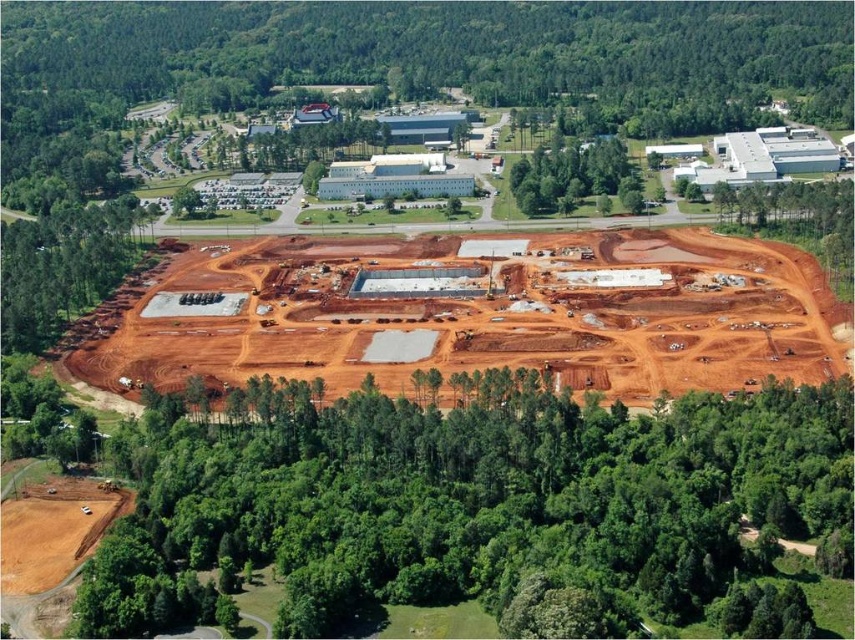
Question: Does green leafy trees at lower center appear on the right side of reddish-brown dirt field at center?

Choices:
 (A) yes
 (B) no

Answer: (B)

Question: Which of these objects is positioned closest to the green leafy tree at upper center?

Choices:
 (A) green leafy trees at lower center
 (B) reddish-brown dirt field at center

Answer: (B)

Question: Which point appears closest to the camera in this image?

Choices:
 (A) (287, 451)
 (B) (540, 160)
 (C) (326, 301)

Answer: (A)

Question: Is reddish-brown dirt field at center closer to the viewer compared to green leafy tree at upper center?

Choices:
 (A) no
 (B) yes

Answer: (B)

Question: In this image, where is green leafy trees at lower center located relative to reddish-brown dirt field at center?

Choices:
 (A) below
 (B) above

Answer: (A)

Question: Which object is farther from the camera taking this photo?

Choices:
 (A) green leafy trees at lower center
 (B) reddish-brown dirt field at center

Answer: (B)